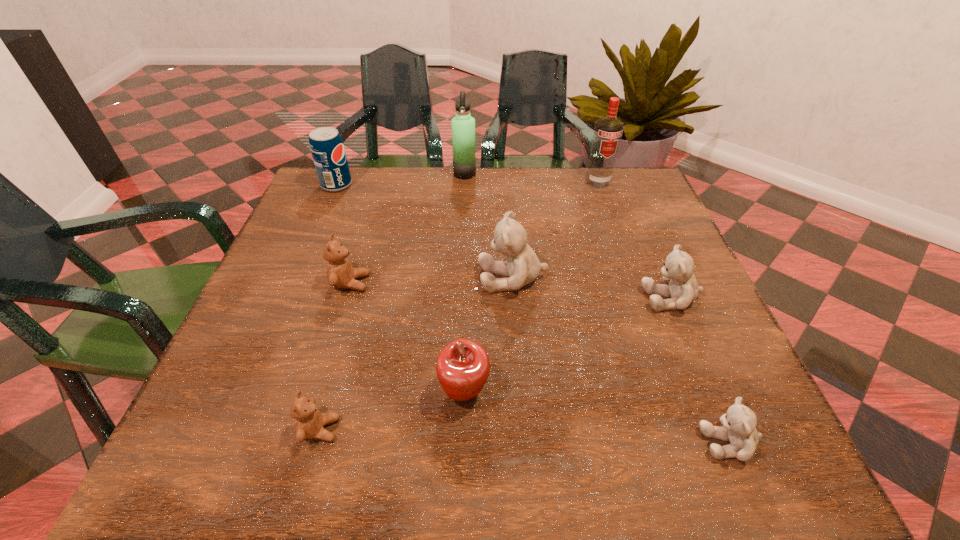
The height and width of the screenshot is (540, 960). I want to click on thermos bottle, so click(463, 125).

Identify the location of vodka. This screenshot has width=960, height=540. (608, 131).

Find the location of `pop`. pop is located at coordinates (327, 148).

The width and height of the screenshot is (960, 540). Find the location of `the leftmost object`. the leftmost object is located at coordinates (327, 148).

Locate an element on the screen. Image resolution: width=960 pixels, height=540 pixels. the leftmost gray teddy bear is located at coordinates coord(510,238).

Where is `the third teddy bear from right to left`? Image resolution: width=960 pixels, height=540 pixels. the third teddy bear from right to left is located at coordinates point(510,238).

This screenshot has height=540, width=960. I want to click on the bigger brown teddy bear, so click(340, 274).

Locate an element on the screen. the second biggest gray teddy bear is located at coordinates (683, 289).

Where is `apple`? apple is located at coordinates (462, 367).

Image resolution: width=960 pixels, height=540 pixels. I want to click on the smaller brown teddy bear, so click(x=309, y=421).